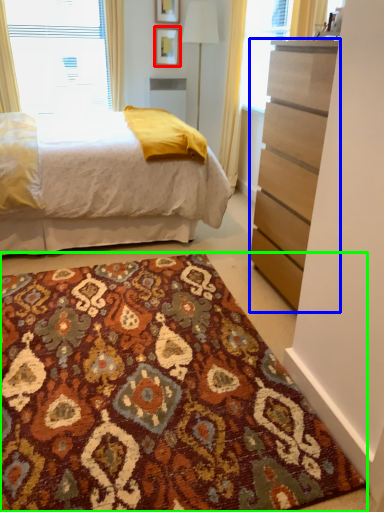
Question: Which object is the farthest from picture frame (highlighted by a red box)? Choose among these: chest of drawers (highlighted by a blue box) or doormat (highlighted by a green box).

Choices:
 (A) chest of drawers
 (B) doormat

Answer: (B)